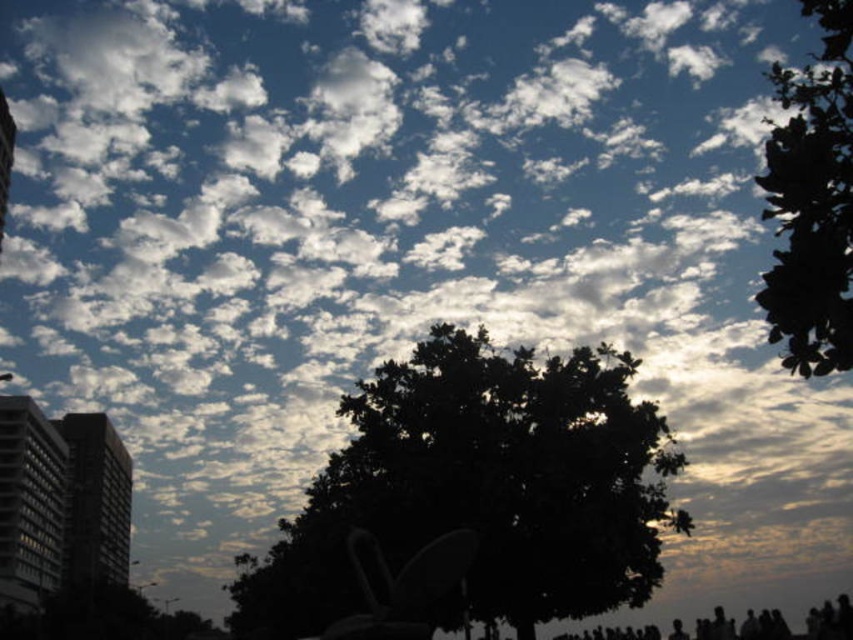
Does point (44, 428) come closer to viewer compared to point (111, 525)?

Yes, it is in front of point (111, 525).

Is point (12, 547) positioned in front of point (68, 452)?

Yes, it is.

Identify the location of gray concrete building at left. (30, 502).

Who is more distant from viewer, (843, 339) or (4, 586)?

Positioned behind is point (4, 586).

Is point (802, 150) behind point (30, 449)?

No, (802, 150) is closer to viewer.

Find the location of a particular element. green leafy tree at upper right is located at coordinates (811, 202).

Is dark green leafy tree at center above green leafy tree at upper right?

No.

How much distance is there between dark green leafy tree at center and green leafy tree at upper right?

The distance of dark green leafy tree at center from green leafy tree at upper right is 31.68 meters.

Who is more distant from viewer, (370, 384) or (784, 100)?

Positioned behind is point (370, 384).

You are a GUI agent. You are given a task and a screenshot of the screen. Output one action in this format:
    pyautogui.click(x=<x>, y=<y>)
    Task: Click on the dark green leafy tree at center
    
    Given the screenshot: What is the action you would take?
    [x=480, y=486]